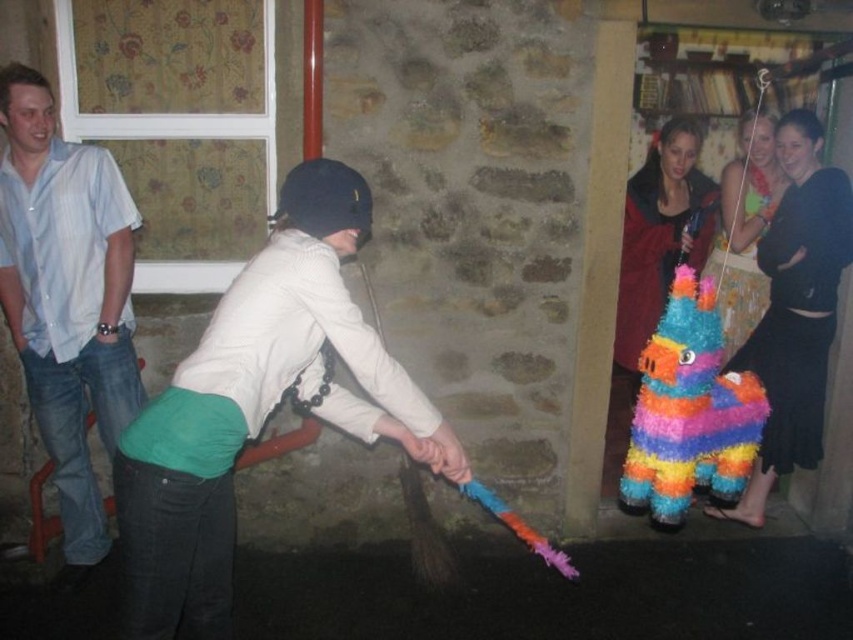
Looking at this image, which is more to the left, white matte helmet at center or multicolored paper pinata at center?

From the viewer's perspective, white matte helmet at center appears more on the left side.

Is white matte helmet at center to the left of multicolored paper pinata at center from the viewer's perspective?

Indeed, white matte helmet at center is positioned on the left side of multicolored paper pinata at center.

Which is behind, point (311, 268) or point (708, 276)?

The point (708, 276) is behind.

Find the location of `white matte helmet at center`. white matte helmet at center is located at coordinates (257, 404).

Is point (30, 161) positioned behind point (697, 420)?

Yes, it is.

Locate an element on the screen. light blue striped shirt at left is located at coordinates (67, 296).

Is point (236, 317) less distant than point (53, 307)?

Yes, it is.

Is white matte helmet at center wider than light blue striped shirt at left?

Correct, the width of white matte helmet at center exceeds that of light blue striped shirt at left.

Locate an element on the screen. white matte helmet at center is located at coordinates (257, 404).